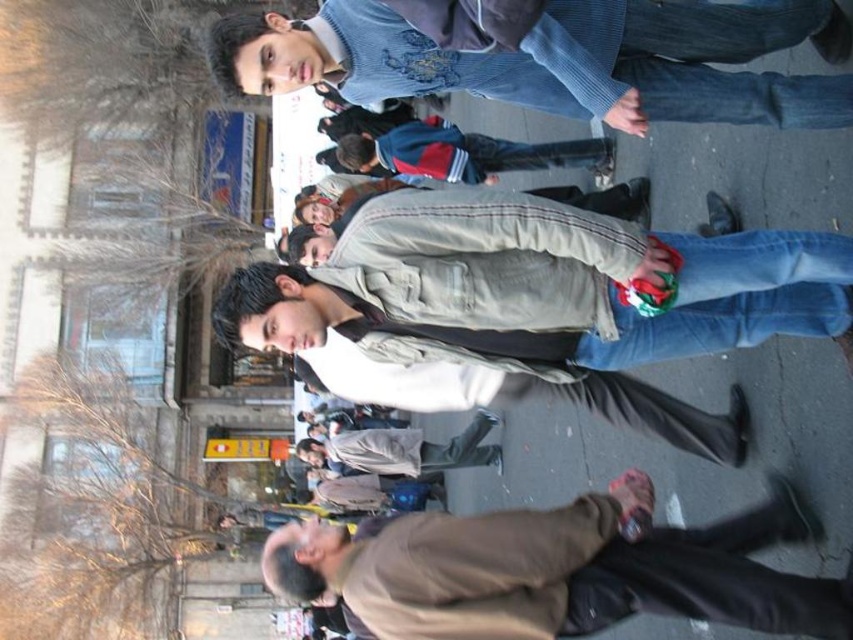
You are standing on the sidewalk and see two people wearing jackets. One is wearing a brown matte jacket at lower right, and the other is wearing a light brown leather jacket at center. Which jacket is positioned to the right of the other?

The brown matte jacket at lower right is positioned to the right of the light brown leather jacket at center.

You are a tailor who needs to determine which jacket requires more fabric to make between the brown matte jacket at lower right and the light brown leather jacket at center. Based on the description, which one would need more fabric?

The light brown leather jacket at center requires more fabric because it is larger in size compared to the brown matte jacket at lower right.

Consider the image. Based on the scene description, where exactly is the dark blue jacket at center located in terms of coordinates?

The dark blue jacket at center is located at coordinates point [463,152].